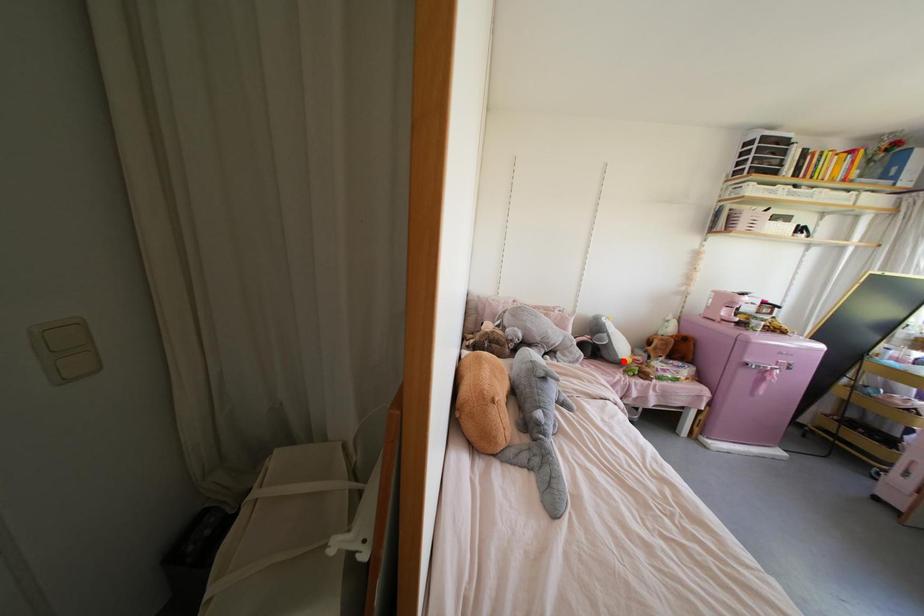
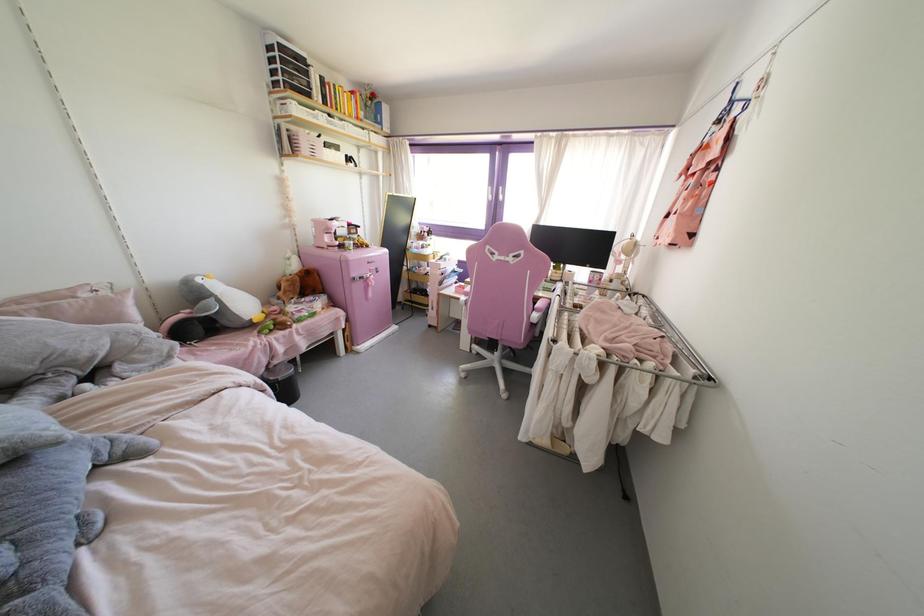
The point at the highlighted location is marked in the first image. Where is the corresponding point in the second image?

(254, 320)